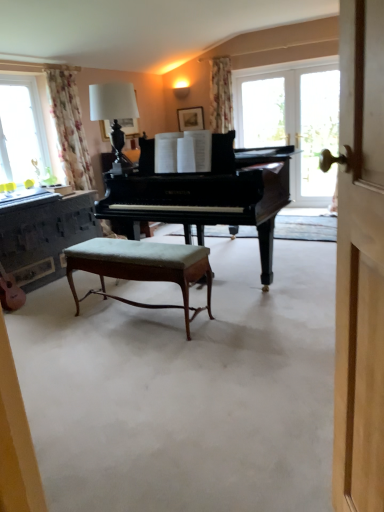
Question: Can you confirm if transparent glass door at right is thinner than wooden stool at center?

Choices:
 (A) no
 (B) yes

Answer: (B)

Question: Are transparent glass door at right and wooden stool at center far apart?

Choices:
 (A) no
 (B) yes

Answer: (B)

Question: Does transparent glass door at right appear on the right side of wooden stool at center?

Choices:
 (A) no
 (B) yes

Answer: (B)

Question: From a real-world perspective, does transparent glass door at right sit lower than wooden stool at center?

Choices:
 (A) no
 (B) yes

Answer: (A)

Question: Does transparent glass door at right appear on the left side of wooden stool at center?

Choices:
 (A) yes
 (B) no

Answer: (B)

Question: From the image's perspective, is transparent glass door at right positioned above or below floral fabric curtain at left?

Choices:
 (A) above
 (B) below

Answer: (A)

Question: Considering the positions of transparent glass door at right and floral fabric curtain at left in the image, is transparent glass door at right taller or shorter than floral fabric curtain at left?

Choices:
 (A) short
 (B) tall

Answer: (B)

Question: Does point (302, 88) appear closer or farther from the camera than point (69, 156)?

Choices:
 (A) closer
 (B) farther

Answer: (B)

Question: Based on their sizes in the image, would you say transparent glass door at right is bigger or smaller than floral fabric curtain at left?

Choices:
 (A) big
 (B) small

Answer: (B)

Question: Considering the positions of wooden dresser at left and green fabric stool at center in the image, is wooden dresser at left wider or thinner than green fabric stool at center?

Choices:
 (A) thin
 (B) wide

Answer: (B)

Question: From a real-world perspective, is wooden dresser at left above or below green fabric stool at center?

Choices:
 (A) below
 (B) above

Answer: (B)

Question: In terms of height, does wooden dresser at left look taller or shorter compared to green fabric stool at center?

Choices:
 (A) short
 (B) tall

Answer: (B)

Question: In the image, is wooden dresser at left positioned in front of or behind green fabric stool at center?

Choices:
 (A) behind
 (B) front

Answer: (A)

Question: In the image, is wooden stool at center positioned in front of or behind shiny black piano at center?

Choices:
 (A) behind
 (B) front

Answer: (B)

Question: Is wooden stool at center to the left or to the right of shiny black piano at center in the image?

Choices:
 (A) left
 (B) right

Answer: (A)